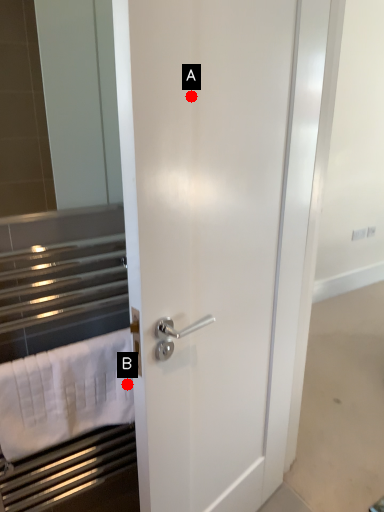
Question: Two points are circled on the image, labeled by A and B beside each circle. Which point is farther from the camera taking this photo?

Choices:
 (A) A is further
 (B) B is further

Answer: (B)